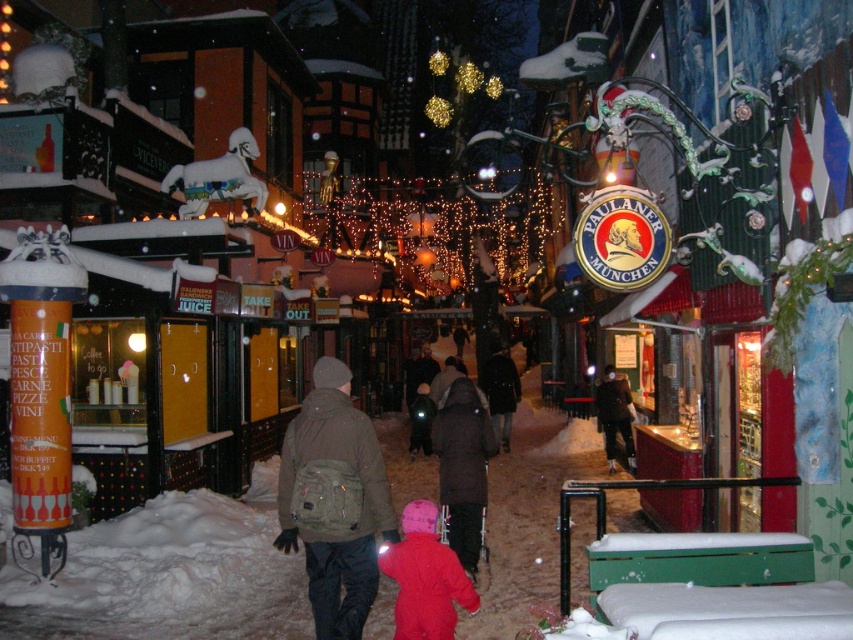
Does olive green backpack at center have a lesser height compared to dark brown coat at center?

Yes.

Which is in front, point (308, 593) or point (479, 403)?

Positioned in front is point (308, 593).

Who is more forward, (318, 620) or (465, 532)?

Point (318, 620) is in front.

In order to click on olive green backpack at center in this screenshot , I will do `click(334, 500)`.

The height and width of the screenshot is (640, 853). What do you see at coordinates (334, 500) in the screenshot? I see `olive green backpack at center` at bounding box center [334, 500].

Is olive green backpack at center taller than matte pink snowsuit at lower center?

Indeed, olive green backpack at center has a greater height compared to matte pink snowsuit at lower center.

Is point (384, 529) behind point (427, 580)?

Yes, point (384, 529) is behind point (427, 580).

You are a GUI agent. You are given a task and a screenshot of the screen. Output one action in this format:
    pyautogui.click(x=<x>, y=<y>)
    Task: Click on the olive green backpack at center
    Image resolution: width=853 pixels, height=640 pixels.
    Given the screenshot: What is the action you would take?
    pyautogui.click(x=334, y=500)

Is matte pink snowsuit at lower center smaller than dark brown coat at center?

Yes.

Does matte pink snowsuit at lower center have a greater width compared to dark brown coat at center?

Yes, matte pink snowsuit at lower center is wider than dark brown coat at center.

Locate an element on the screen. This screenshot has width=853, height=640. matte pink snowsuit at lower center is located at coordinates [x=425, y=577].